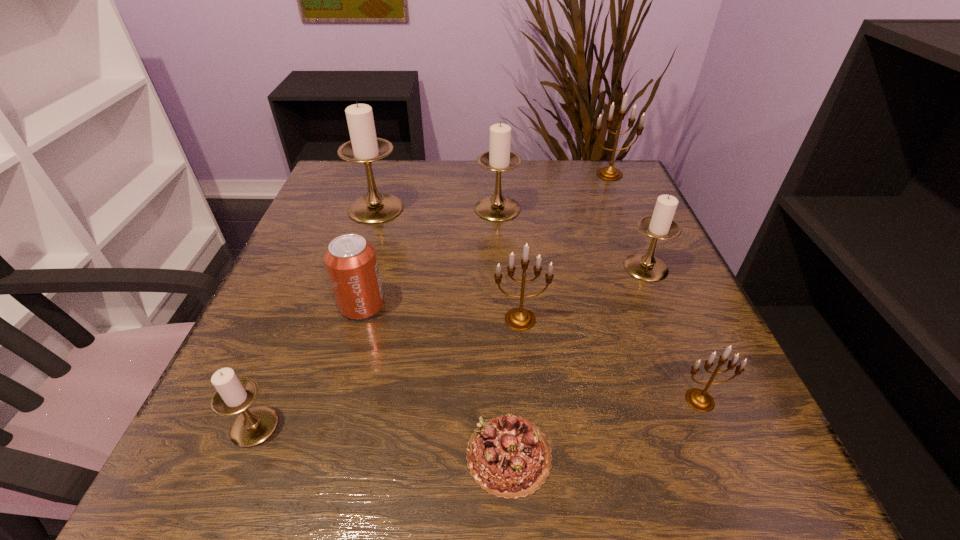
Locate an element on the screen. the tallest candle holder is located at coordinates (364, 147).

Locate an element on the screen. the biggest white candle holder is located at coordinates coord(364,147).

Where is `the farthest object`? Image resolution: width=960 pixels, height=540 pixels. the farthest object is located at coordinates (609, 173).

Where is `the farthest candle holder`? the farthest candle holder is located at coordinates (609, 173).

Where is `the third smallest white candle holder`? The image size is (960, 540). the third smallest white candle holder is located at coordinates (499, 158).

The width and height of the screenshot is (960, 540). I want to click on the second smallest gold candelabrum, so click(x=519, y=318).

Locate an element on the screen. This screenshot has height=540, width=960. the leftmost gold candelabrum is located at coordinates point(519,318).

This screenshot has height=540, width=960. In order to click on the second nearest white candle holder in this screenshot , I will do `click(645, 266)`.

Identify the location of the second smallest white candle holder. (645, 266).

At what (x,y) coordinates should I click in order to perform the action: click on orange can. Please return your answer as a coordinate pair (x, y). The width and height of the screenshot is (960, 540). Looking at the image, I should click on (351, 262).